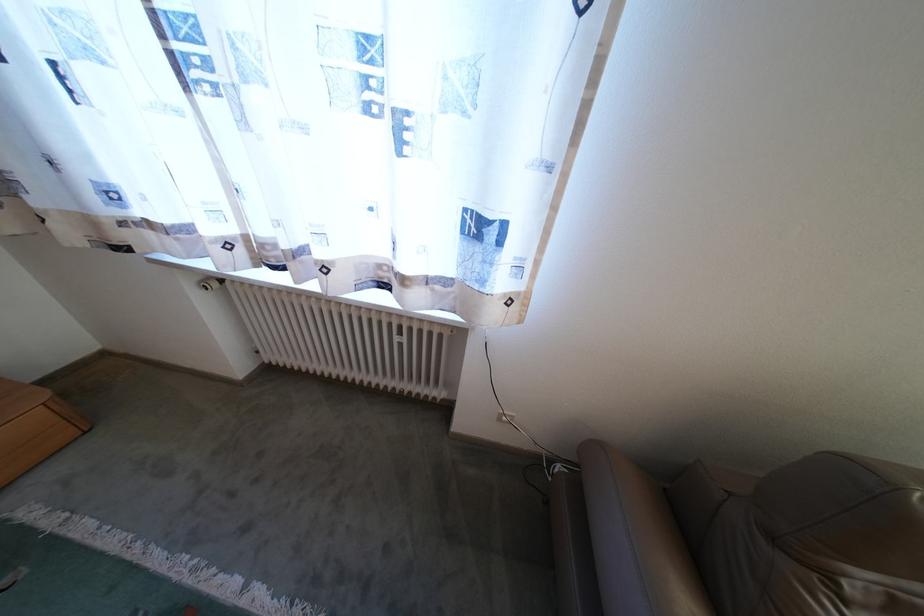
Find where to adjust the white security camera. Please return your answer as a coordinate pair (x, y).

(210, 283)